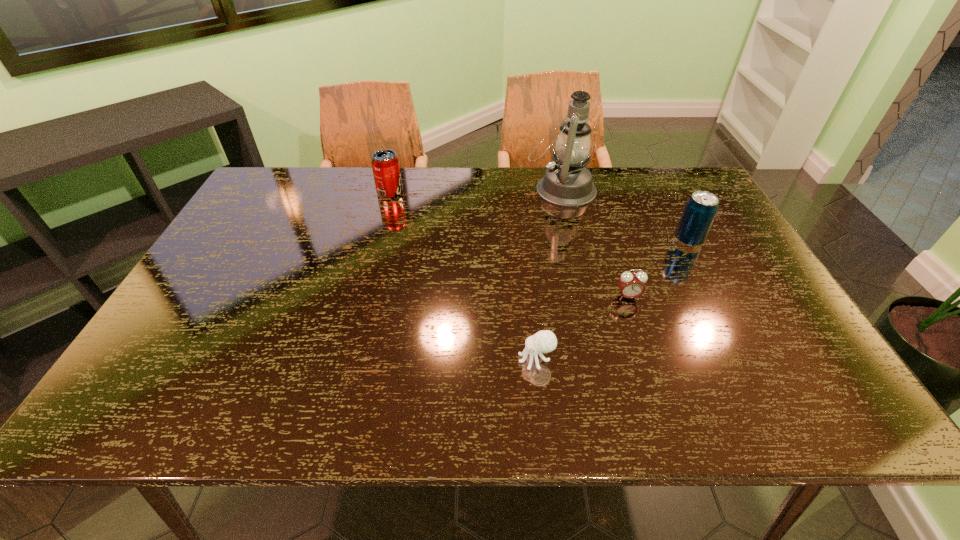
Find the location of a particular element. This screenshot has width=960, height=540. free space that satisfies the following two spatial constraints: 1. on the clock face of the alarm clock; 2. on the front-facing side of the octopus is located at coordinates coord(649,359).

You are a GUI agent. You are given a task and a screenshot of the screen. Output one action in this format:
    pyautogui.click(x=<x>, y=<y>)
    Task: Click on the free space that satisfies the following two spatial constraints: 1. on the clock face of the second nearest object; 2. on the front-facing side of the nearest object
    This screenshot has width=960, height=540.
    Given the screenshot: What is the action you would take?
    pyautogui.click(x=649, y=359)